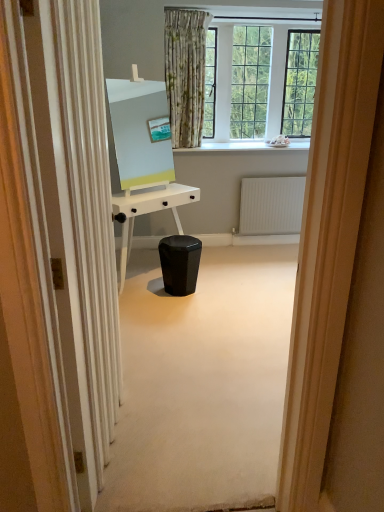
Find the location of a particular element. The width and height of the screenshot is (384, 512). unoccupied area behind white glossy screen door at left is located at coordinates click(164, 369).